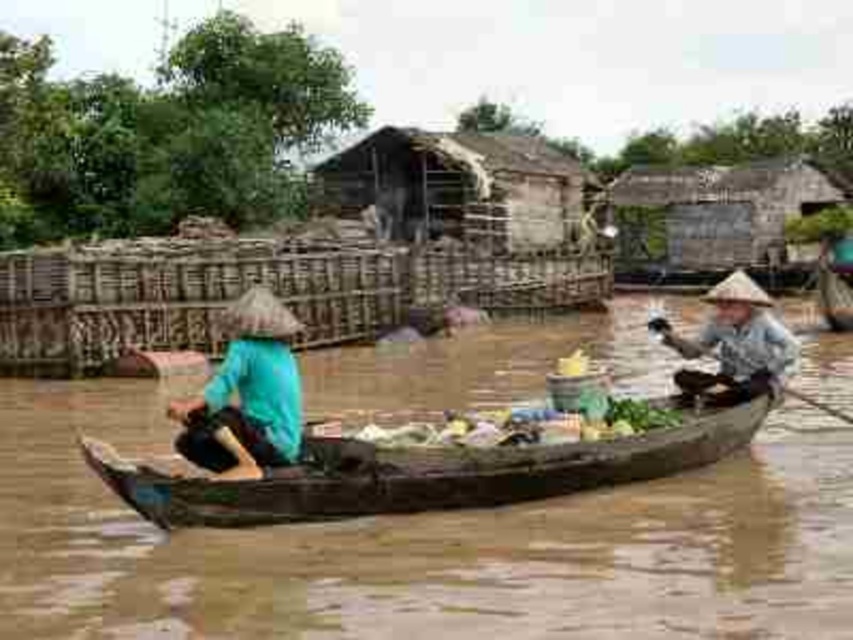
Question: Is wooden canoe at center bigger than teal fabric hat at left?

Choices:
 (A) yes
 (B) no

Answer: (B)

Question: Is brown wooden boat at center smaller than wooden canoe at center?

Choices:
 (A) no
 (B) yes

Answer: (A)

Question: Considering the real-world distances, which object is closest to the teal fabric hat at left?

Choices:
 (A) brown wooden boat at center
 (B) matte brown hat at right
 (C) wooden canoe at center

Answer: (A)

Question: Which is farther from the matte brown hat at right?

Choices:
 (A) wooden canoe at center
 (B) brown wooden boat at center

Answer: (A)

Question: Is wooden canoe at center closer to camera compared to teal fabric hat at left?

Choices:
 (A) no
 (B) yes

Answer: (A)

Question: Which point appears farthest from the camera in this image?

Choices:
 (A) (277, 451)
 (B) (762, 304)
 (C) (577, 563)

Answer: (B)